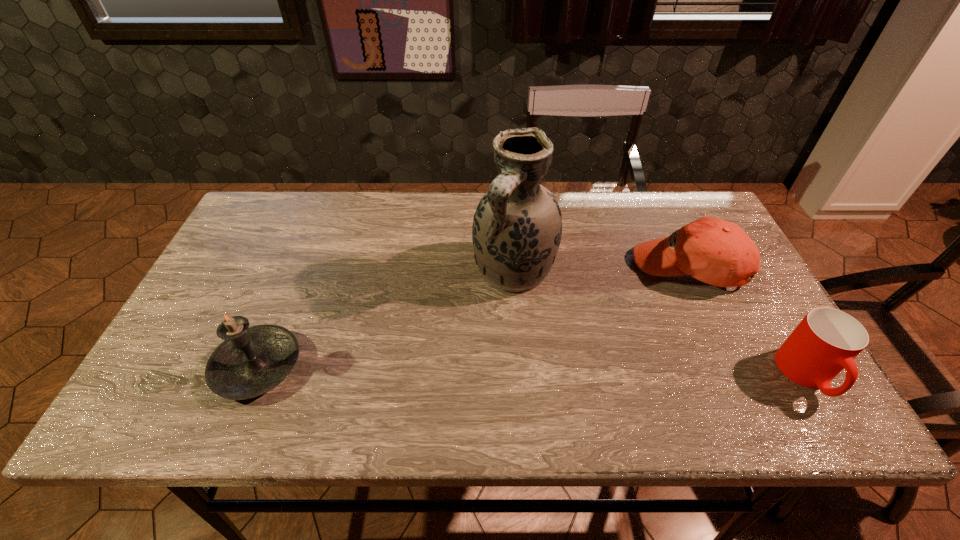
The image size is (960, 540). I want to click on free point between the tallest object and the baseball cap, so click(601, 269).

This screenshot has width=960, height=540. Find the location of `free area in between the leftmost object and the cup`. free area in between the leftmost object and the cup is located at coordinates (532, 371).

I want to click on vacant area that lies between the second tallest object and the baseball cap, so click(472, 318).

Identify the location of free space between the tallest object and the leftmost object. (386, 319).

Find the location of `free space that is in between the baseball cap and the candle`. free space that is in between the baseball cap and the candle is located at coordinates (472, 318).

This screenshot has height=540, width=960. Identify the location of empty space between the baseball cap and the second object from left to right. (601, 269).

Identify which object is the nearest to the vase. Please provide its 2D coordinates. Your answer should be formatted as a tuple, i.e. [(x, y)], where the tuple contains the x and y coordinates of a point satisfying the conditions above.

[(717, 252)]

Identify which object is the third closest to the candle. Please provide its 2D coordinates. Your answer should be formatted as a tuple, i.e. [(x, y)], where the tuple contains the x and y coordinates of a point satisfying the conditions above.

[(826, 341)]

Identify the location of free space in the image that satisfies the following two spatial constraints: 1. on the back side of the tallest object; 2. on the left side of the second tallest object. (297, 271).

The width and height of the screenshot is (960, 540). What are the coordinates of `vacant region that satisfies the following two spatial constraints: 1. on the back side of the baseball cap; 2. on the right side of the tallest object` in the screenshot? It's located at (514, 268).